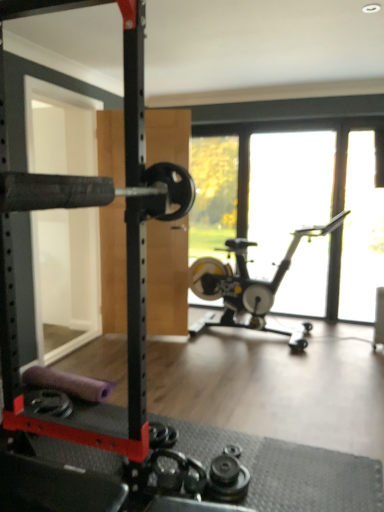
Question: Is transparent glass window screen at right bigger than silver metallic stationary bicycle at center?

Choices:
 (A) yes
 (B) no

Answer: (B)

Question: Is transparent glass window screen at right aimed at silver metallic stationary bicycle at center?

Choices:
 (A) yes
 (B) no

Answer: (A)

Question: Is silver metallic stationary bicycle at center completely or partially inside transparent glass window screen at right?

Choices:
 (A) no
 (B) yes

Answer: (A)

Question: Is transparent glass window screen at right with silver metallic stationary bicycle at center?

Choices:
 (A) yes
 (B) no

Answer: (B)

Question: Are transparent glass window screen at right and silver metallic stationary bicycle at center far apart?

Choices:
 (A) no
 (B) yes

Answer: (A)

Question: Considering the positions of silver metallic stationary bicycle at center and transparent glass window screen at right in the image, is silver metallic stationary bicycle at center taller or shorter than transparent glass window screen at right?

Choices:
 (A) tall
 (B) short

Answer: (B)

Question: Visually, is silver metallic stationary bicycle at center positioned to the left or to the right of transparent glass window screen at right?

Choices:
 (A) left
 (B) right

Answer: (A)

Question: Looking at the image, does silver metallic stationary bicycle at center seem bigger or smaller compared to transparent glass window screen at right?

Choices:
 (A) big
 (B) small

Answer: (A)

Question: Which is correct: silver metallic stationary bicycle at center is inside transparent glass window screen at right, or outside of it?

Choices:
 (A) inside
 (B) outside

Answer: (B)

Question: Based on their sizes in the image, would you say transparent glass window screen at right is bigger or smaller than black rubber barbell at left?

Choices:
 (A) big
 (B) small

Answer: (B)

Question: From the image's perspective, relative to black rubber barbell at left, is transparent glass window screen at right above or below?

Choices:
 (A) above
 (B) below

Answer: (A)

Question: In terms of width, does transparent glass window screen at right look wider or thinner when compared to black rubber barbell at left?

Choices:
 (A) wide
 (B) thin

Answer: (B)

Question: From a real-world perspective, is transparent glass window screen at right positioned above or below black rubber barbell at left?

Choices:
 (A) below
 (B) above

Answer: (A)

Question: In terms of size, does black rubber barbell at left appear bigger or smaller than silver metallic stationary bicycle at center?

Choices:
 (A) big
 (B) small

Answer: (B)

Question: Considering the positions of black rubber barbell at left and silver metallic stationary bicycle at center in the image, is black rubber barbell at left taller or shorter than silver metallic stationary bicycle at center?

Choices:
 (A) tall
 (B) short

Answer: (A)